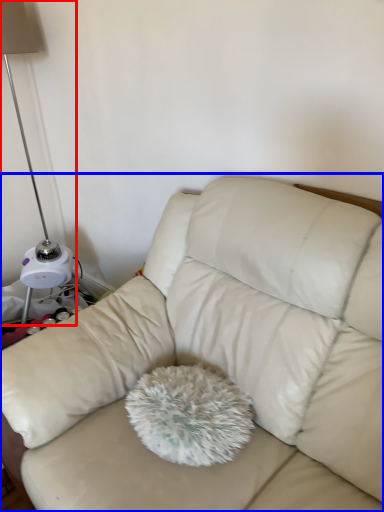
Question: Which object appears farthest to the camera in this image, lamp (highlighted by a red box) or studio couch (highlighted by a blue box)?

Choices:
 (A) lamp
 (B) studio couch

Answer: (A)